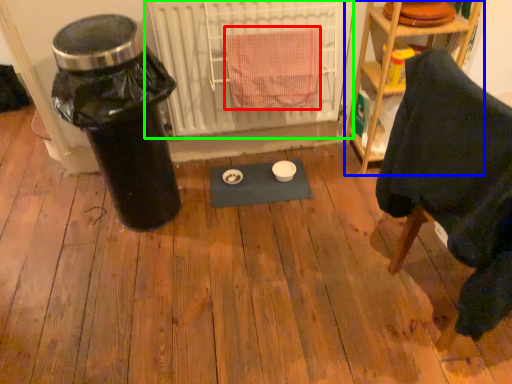
Question: Which object is positioned farthest from bath towel (highlighted by a red box)? Select from shelf (highlighted by a blue box) and radiator (highlighted by a green box).

Choices:
 (A) shelf
 (B) radiator

Answer: (A)